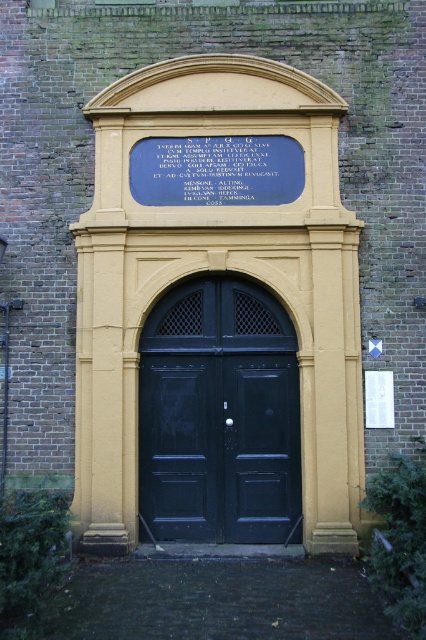
Can you confirm if black wooden door at center is thinner than blue stone plaque at upper center?

Yes, black wooden door at center is thinner than blue stone plaque at upper center.

Does black wooden door at center have a lesser height compared to blue stone plaque at upper center?

Incorrect, black wooden door at center's height does not fall short of blue stone plaque at upper center's.

Is point (172, 442) behind point (173, 186)?

No, it is in front of (173, 186).

At what (x,y) coordinates should I click in order to perform the action: click on black wooden door at center. Please return your answer as a coordinate pair (x, y). Looking at the image, I should click on (218, 416).